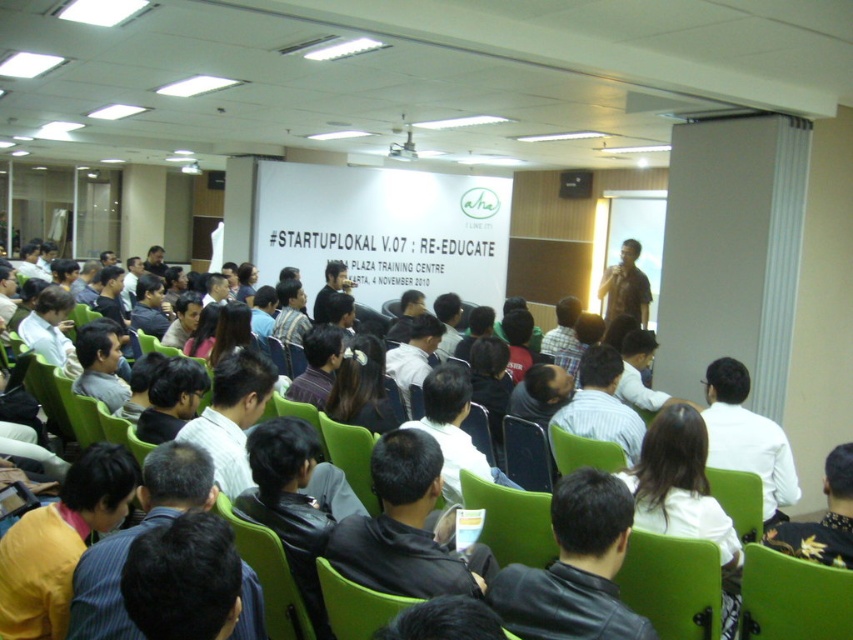
You are attending a conference and see two people in the room. One is wearing a yellow shirt at lower left and the other a matte white shirt at center. From your perspective, which person is standing closer to the front of the room?

The yellow shirt at lower left is below the matte white shirt at center, so the yellow shirt at lower left is closer to the front of the room.

You are organizing a photo shoot in the conference room and need to position two props, the black leather jacket at lower center and the yellow shirt at lower left, such that they are both visible in the frame. Considering their sizes, which prop should you place closer to the camera to ensure both are clearly visible?

The black leather jacket at lower center occupies less space than the yellow shirt at lower left, so you should place the black leather jacket at lower center closer to the camera to compensate for its smaller size and ensure both are visible.

You are attending a seminar and want to sit closer to the front. You see the green fabric chair at lower right and the matte white shirt at center. Which object is closer to you?

The green fabric chair at lower right is closer to the viewer than the matte white shirt at center.